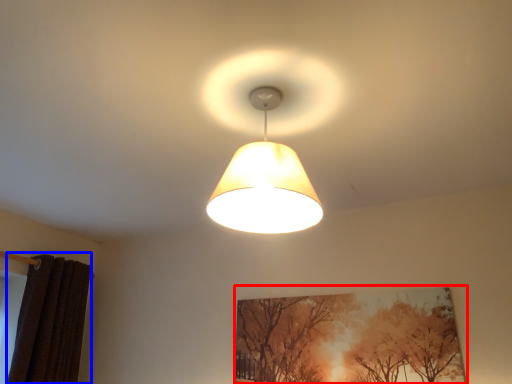
Question: Among these objects, which one is farthest to the camera, picture frame (highlighted by a red box) or curtain (highlighted by a blue box)?

Choices:
 (A) picture frame
 (B) curtain

Answer: (B)